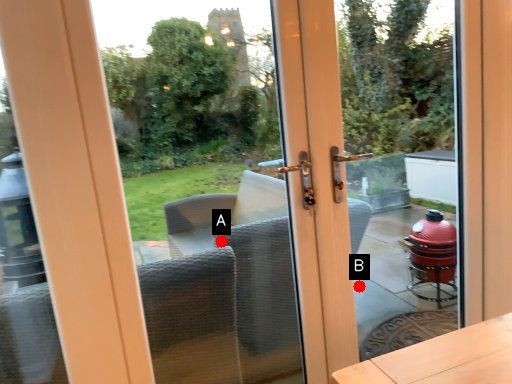
Question: Two points are circled on the image, labeled by A and B beside each circle. Which point is farther to the camera?

Choices:
 (A) A is further
 (B) B is further

Answer: (B)